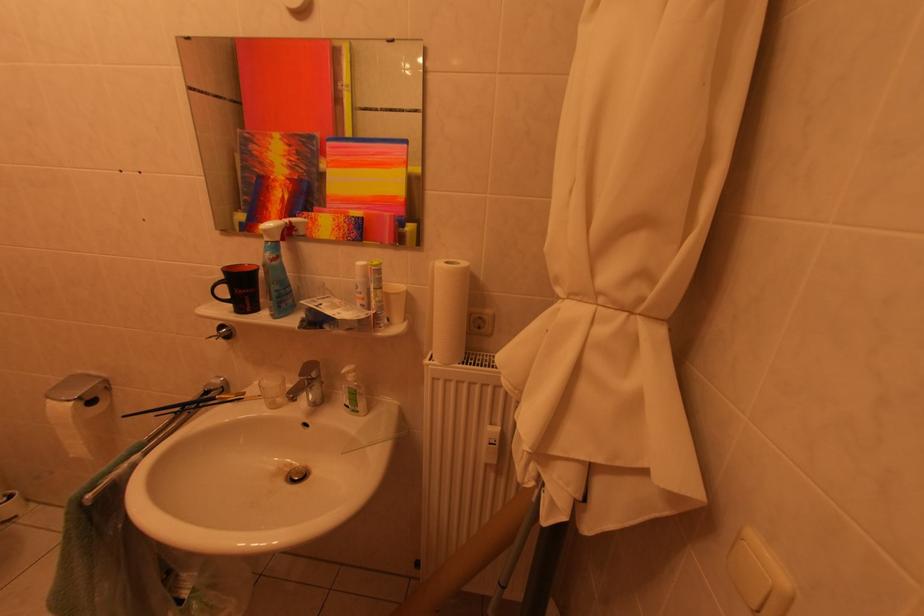
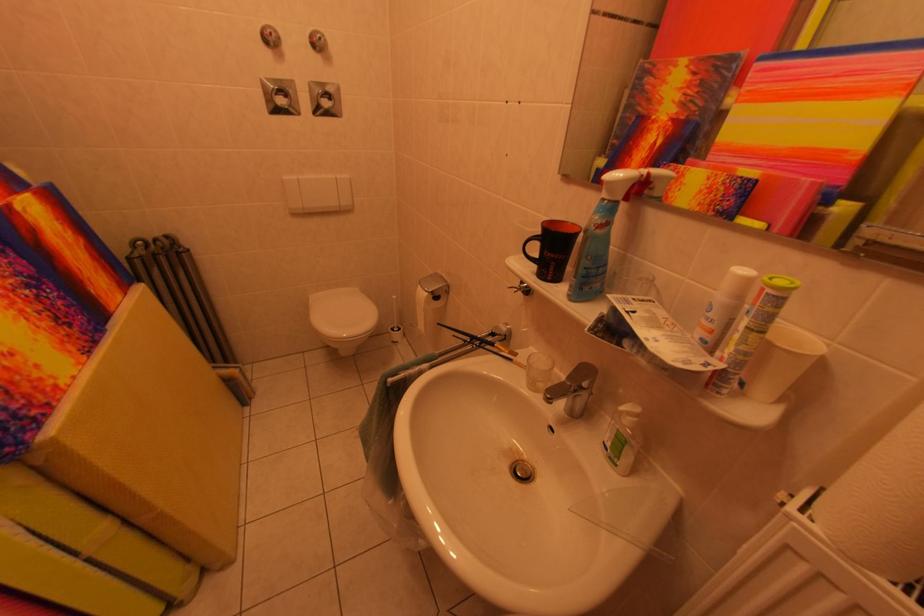
In the second image, find the point that corresponds to point (283, 267) in the first image.

(606, 235)